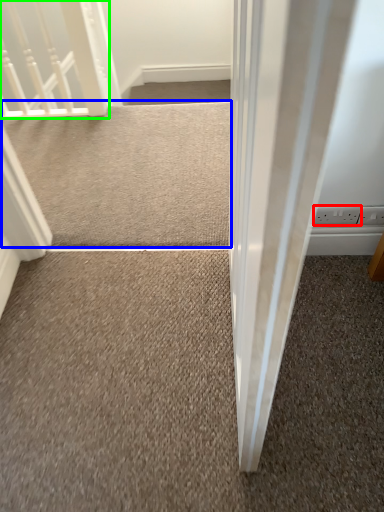
Question: Estimate the real-world distances between objects in this image. Which object is farther from electric outlet (highlighted by a red box), doormat (highlighted by a blue box) or rail (highlighted by a green box)?

Choices:
 (A) doormat
 (B) rail

Answer: (B)